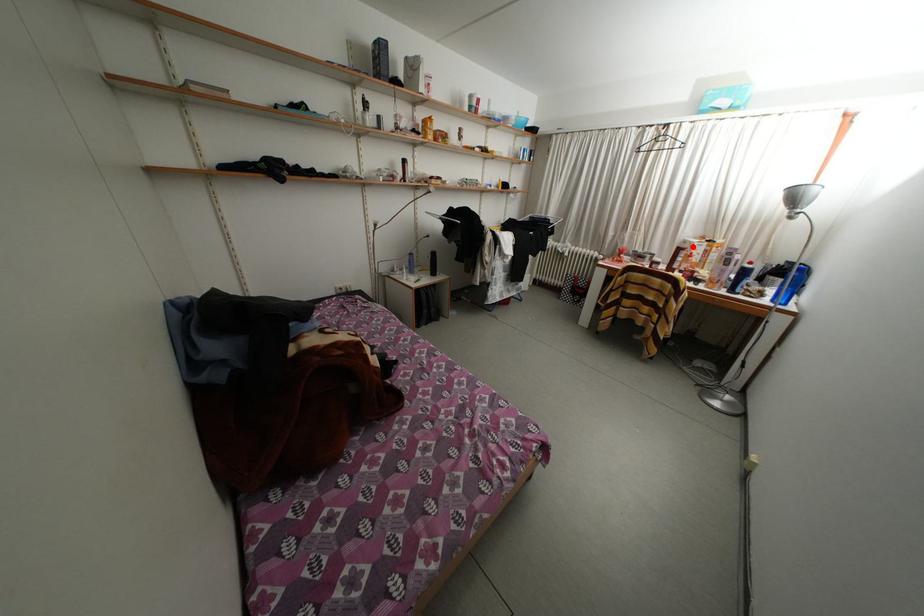
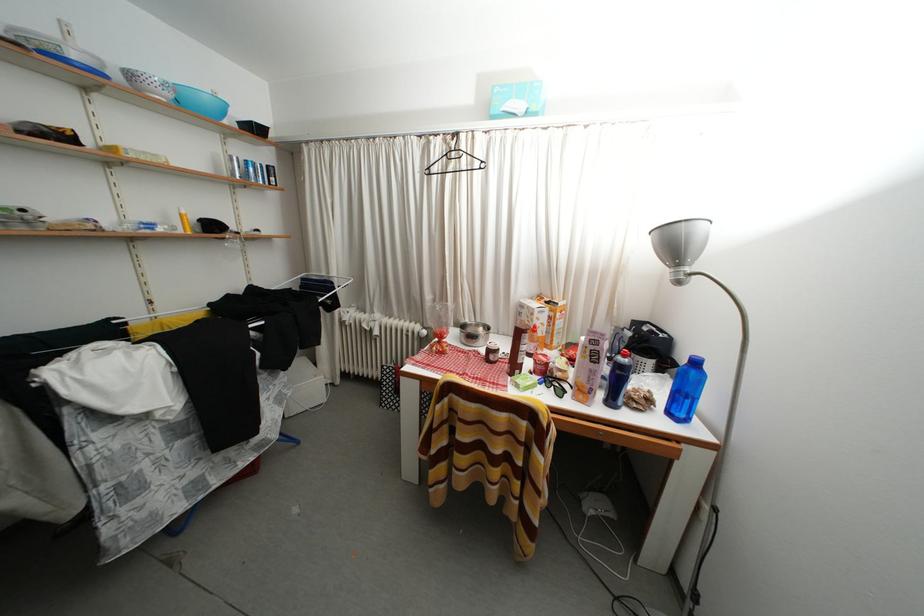
Where in the second image is the point corresponding to the highlighted location from the first image?

(529, 310)